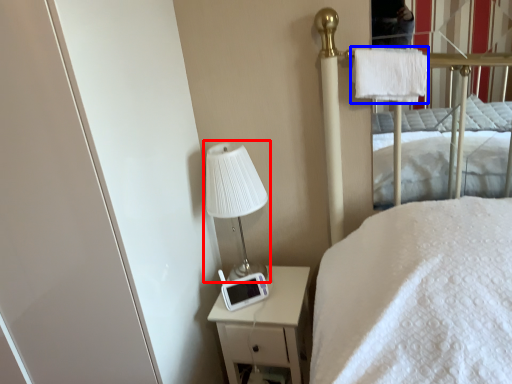
Question: Which point is closer to the camera, table lamp (highlighted by a red box) or cloth (highlighted by a blue box)?

Choices:
 (A) table lamp
 (B) cloth

Answer: (B)